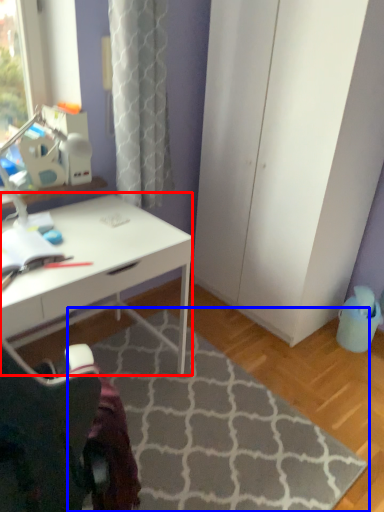
Question: Which object appears closest to the camera in this image, desk (highlighted by a red box) or doormat (highlighted by a blue box)?

Choices:
 (A) desk
 (B) doormat

Answer: (B)